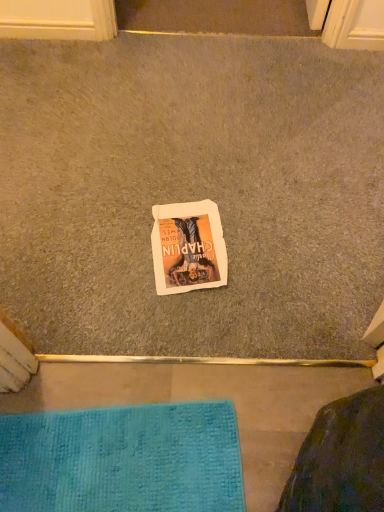
The width and height of the screenshot is (384, 512). What do you see at coordinates (192, 193) in the screenshot?
I see `gray carpet at center` at bounding box center [192, 193].

Measure the distance between gray carpet at center and camera.

gray carpet at center is 3.40 feet from camera.

Where is `gray carpet at center`? The image size is (384, 512). gray carpet at center is located at coordinates (192, 193).

Where is `gray carpet at center`? This screenshot has width=384, height=512. gray carpet at center is located at coordinates (192, 193).